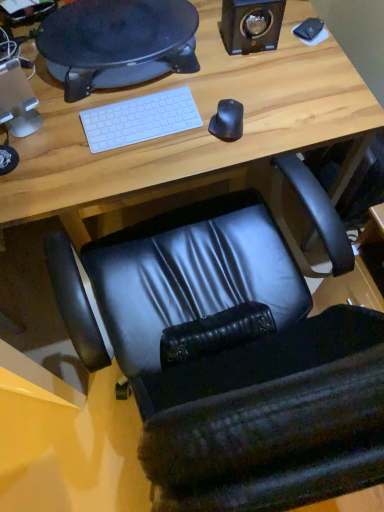
The image size is (384, 512). I want to click on matte black chair at lower center, so click(189, 131).

What do you see at coordinates (117, 42) in the screenshot? This screenshot has width=384, height=512. I see `matte black desk at upper center` at bounding box center [117, 42].

At what (x,y) coordinates should I click in order to perform the action: click on matte black chair at lower center. Please return your answer as a coordinate pair (x, y). This screenshot has width=384, height=512. Looking at the image, I should click on (189, 131).

Is black rubber mouse at center oriented towards matte black chair at lower center?

No, black rubber mouse at center is not turned towards matte black chair at lower center.

Image resolution: width=384 pixels, height=512 pixels. In order to click on desk that appears above the black rubber mouse at center (from the image's perspective) in this screenshot , I will do `click(189, 131)`.

Looking at this image, which is more to the right, black rubber mouse at center or matte black chair at lower center?

Positioned to the right is black rubber mouse at center.

From the image's perspective, between black rubber mouse at center and black leather chair at center, who is located below?

From the image's view, black leather chair at center is below.

Considering the positions of objects black rubber mouse at center and black leather chair at center in the image provided, who is in front, black rubber mouse at center or black leather chair at center?

Positioned in front is black leather chair at center.

Are black rubber mouse at center and black leather chair at center far apart?

They are positioned close to each other.

From a real-world perspective, who is located higher, black rubber mouse at center or black leather chair at center?

black rubber mouse at center.

Is point (144, 177) closer to camera compared to point (222, 106)?

Yes, it is.

Who is shorter, matte black chair at lower center or black rubber mouse at center?

black rubber mouse at center.

Looking at this image, is matte black chair at lower center smaller than black rubber mouse at center?

Actually, matte black chair at lower center might be larger than black rubber mouse at center.

From a real-world perspective, is matte black chair at lower center under black rubber mouse at center?

Yes, from a real-world perspective, matte black chair at lower center is under black rubber mouse at center.

How different are the orientations of white matte keyboard at center and black rubber mouse at center in degrees?

23.9 degrees.

Is white matte keyboard at center spatially inside black rubber mouse at center, or outside of it?

white matte keyboard at center is not inside black rubber mouse at center, it's outside.

Which is in front, white matte keyboard at center or black rubber mouse at center?

black rubber mouse at center.

Does black matte speaker at upper right turn towards matte black desk at upper center?

No, black matte speaker at upper right does not turn towards matte black desk at upper center.

Considering the relative sizes of black matte speaker at upper right and matte black desk at upper center in the image provided, is black matte speaker at upper right bigger than matte black desk at upper center?

No.

In terms of height, does black matte speaker at upper right look taller or shorter compared to matte black desk at upper center?

In the image, black matte speaker at upper right appears to be taller than matte black desk at upper center.

Locate an element on the screen. speaker that is above the matte black desk at upper center (from the image's perspective) is located at coordinates (251, 25).

From the image's perspective, does black leather chair at center appear higher than black rubber mouse at center?

No, from the image's perspective, black leather chair at center is not on top of black rubber mouse at center.

Would you say black leather chair at center contains black rubber mouse at center?

No, black rubber mouse at center is located outside of black leather chair at center.

Between black leather chair at center and black rubber mouse at center, which one has more height?

Standing taller between the two is black leather chair at center.

Could you tell me if matte black chair at lower center is facing black matte speaker at upper right?

No, matte black chair at lower center is not aimed at black matte speaker at upper right.

Considering the positions of objects matte black chair at lower center and black matte speaker at upper right in the image provided, who is more to the left, matte black chair at lower center or black matte speaker at upper right?

matte black chair at lower center is more to the left.

Is matte black chair at lower center closer to the viewer compared to black matte speaker at upper right?

Yes, matte black chair at lower center is closer to the camera.

At what (x,y) coordinates should I click in order to perform the action: click on mouse below the matte black chair at lower center (from the image's perspective). Please return your answer as a coordinate pair (x, y). This screenshot has width=384, height=512. Looking at the image, I should click on (227, 121).

The height and width of the screenshot is (512, 384). I want to click on mouse behind the black leather chair at center, so click(227, 121).

When comparing their distances from black matte speaker at upper right, does matte black desk at upper center or white matte keyboard at center seem closer?

matte black desk at upper center is closer to black matte speaker at upper right.

Which object lies nearer to the anchor point white matte keyboard at center, black rubber mouse at center or matte black chair at lower center?

matte black chair at lower center lies closer to white matte keyboard at center than the other object.

Looking at the image, which one is located closer to matte black chair at lower center, black rubber mouse at center or black matte speaker at upper right?

The object closer to matte black chair at lower center is black rubber mouse at center.

Looking at the image, which one is located closer to white matte keyboard at center, matte black desk at upper center or black rubber mouse at center?

The object closer to white matte keyboard at center is black rubber mouse at center.

Looking at the image, which one is located closer to black leather chair at center, matte black chair at lower center or black rubber mouse at center?

The object closer to black leather chair at center is matte black chair at lower center.

When comparing their distances from black matte speaker at upper right, does black rubber mouse at center or white matte keyboard at center seem closer?

black rubber mouse at center is positioned closer to the anchor black matte speaker at upper right.

Consider the image. From the image, which object appears to be nearer to black leather chair at center, white matte keyboard at center or black rubber mouse at center?

white matte keyboard at center is closer to black leather chair at center.

Based on the photo, from the image, which object appears to be farther from black matte speaker at upper right, white matte keyboard at center or matte black chair at lower center?

white matte keyboard at center is positioned further to the anchor black matte speaker at upper right.

Where is `desk situated between white matte keyboard at center and black rubber mouse at center from left to right`? desk situated between white matte keyboard at center and black rubber mouse at center from left to right is located at coordinates (189, 131).

The width and height of the screenshot is (384, 512). In order to click on computer keyboard between matte black desk at upper center and black matte speaker at upper right in the horizontal direction in this screenshot , I will do `click(140, 119)`.

Locate an element on the screen. The image size is (384, 512). mouse between black leather chair at center and matte black desk at upper center from front to back is located at coordinates (227, 121).

What are the coordinates of `desk located between matte black desk at upper center and black rubber mouse at center in the left-right direction` in the screenshot? It's located at (189, 131).